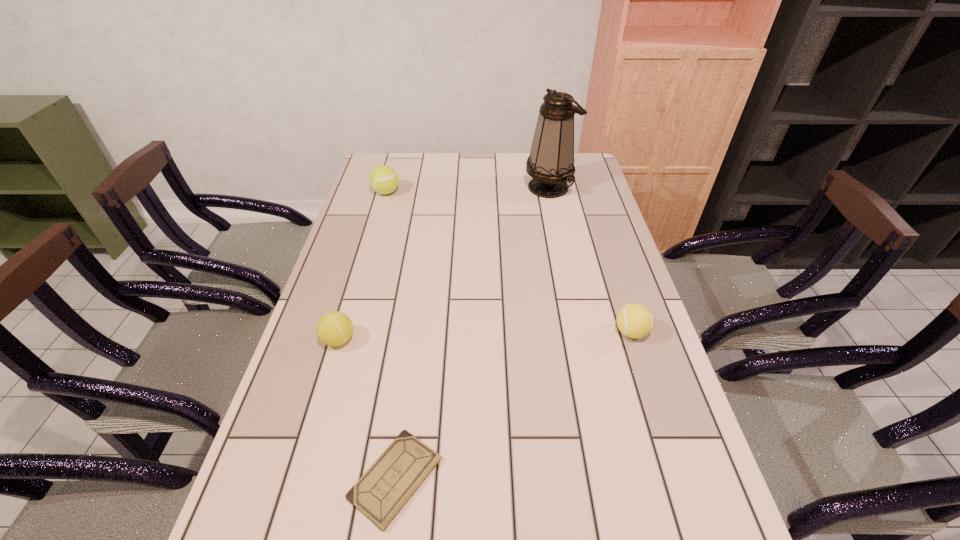
Image resolution: width=960 pixels, height=540 pixels. I want to click on oil lamp that is at the right edge, so click(x=551, y=161).

The width and height of the screenshot is (960, 540). I want to click on tennis ball that is positioned at the right edge, so click(634, 320).

Where is `object at the far right corner`? The height and width of the screenshot is (540, 960). object at the far right corner is located at coordinates (551, 161).

In the image, there is a desktop. Where is `vacant space at the far edge`? The image size is (960, 540). vacant space at the far edge is located at coordinates (510, 160).

The image size is (960, 540). In the image, there is a desktop. In order to click on free space at the left edge in this screenshot , I will do `click(278, 476)`.

Locate an element on the screen. This screenshot has width=960, height=540. vacant space at the right edge of the desktop is located at coordinates (570, 191).

Where is `vacant area at the far left corner`? vacant area at the far left corner is located at coordinates [398, 167].

You are a GUI agent. You are given a task and a screenshot of the screen. Output one action in this format:
    pyautogui.click(x=<x>, y=<y>)
    Task: Click on the free space at the far right corner
    
    Given the screenshot: What is the action you would take?
    pyautogui.click(x=588, y=176)

Where is `free space between the rightmost tennis ball and the oil lamp`? This screenshot has width=960, height=540. free space between the rightmost tennis ball and the oil lamp is located at coordinates (590, 260).

Where is `unoccupied area between the tallest object and the rightmost tennis ball`? This screenshot has height=540, width=960. unoccupied area between the tallest object and the rightmost tennis ball is located at coordinates (590, 260).